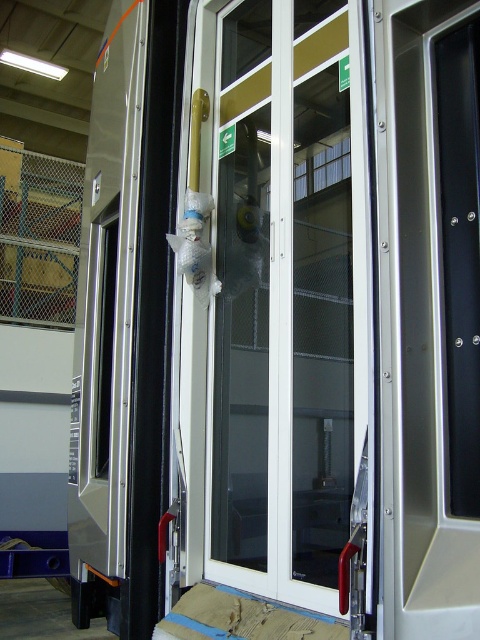
Is point (273, 388) farther from viewer compared to point (399, 636)?

Yes.

Who is more distant from viewer, (226, 564) or (450, 579)?

The point (226, 564) is behind.

What do you see at coordinates (287, 300) in the screenshot?
I see `transparent plastic door at center` at bounding box center [287, 300].

Locate an element on the screen. The width and height of the screenshot is (480, 640). transparent plastic door at center is located at coordinates (287, 300).